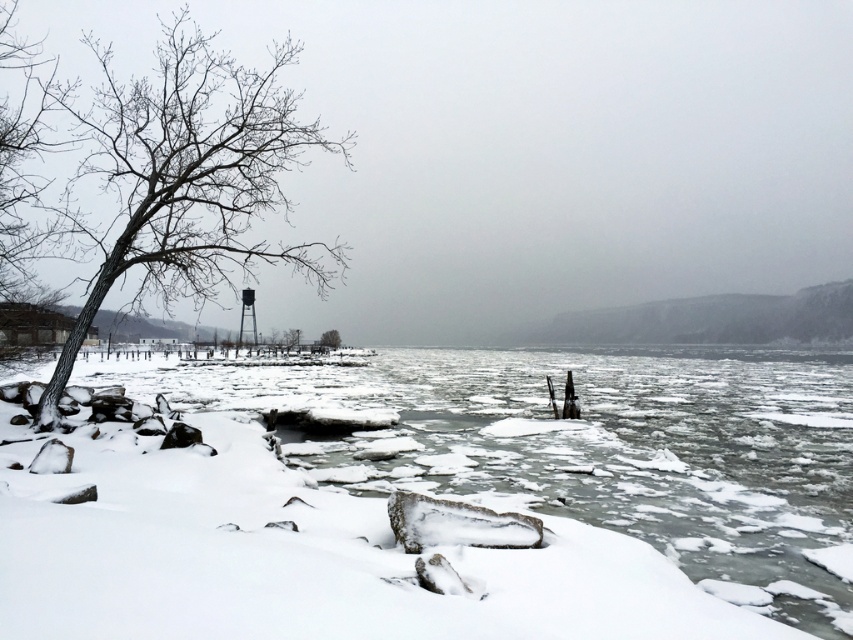
You are standing at the center of the image and want to walk towards the bare wood tree at left. In which direction should you move?

Since the bare wood tree at left is located at point (187, 177) in the image, you should move to the left and slightly downward to reach it.

You are an environmental scientist assessing the health of trees in a winter landscape. You observe the bare wood tree at left and the bare wood tree at center. Which tree would you prioritize for immediate inspection due to its size, and why?

The bare wood tree at left is larger in size than the bare wood tree at center, so it should be prioritized for inspection because larger trees may pose greater risks during winter storms or ice accumulation.

You are an environmental scientist assessing the health of trees in a winter landscape. You observe the bare wood tree at left and the bare wood tree at center. Which tree has a larger trunk circumference?

The bare wood tree at left might be wider than the bare wood tree at center, so it likely has a larger trunk circumference.